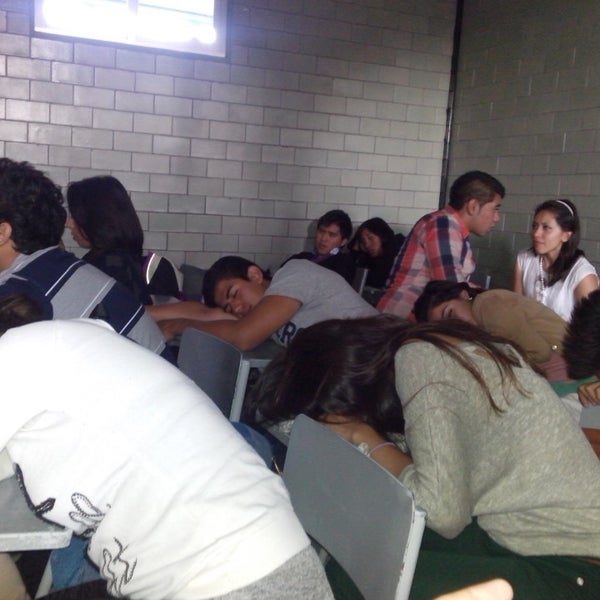
The image size is (600, 600). What are the coordinates of `brick wall` in the screenshot? It's located at (272, 170), (555, 127).